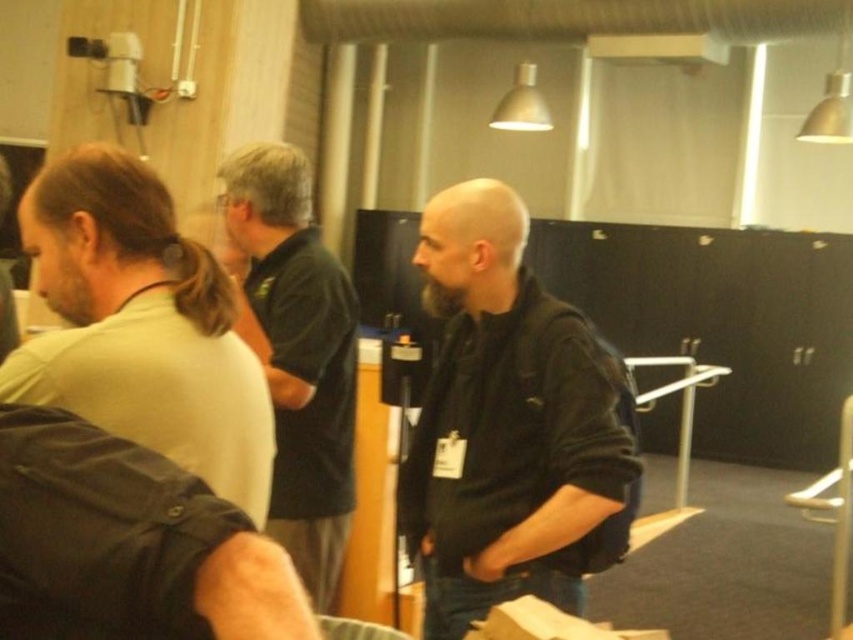
Looking at this image, you are standing in the conference room and need to locate the person wearing the light green shirt at left. According to the spatial coordinates provided, where exactly is this person positioned in the room?

The light green shirt at left is located at point coordinates 0.509 on the x axis and 0.165 on the y axis.

You are standing in the conference room and see two points marked in the image. Which point is closer to you, point (496, 244) or point (131, 310)?

Point (496, 244) is further to the viewer than point (131, 310), so point (131, 310) is closer to you.